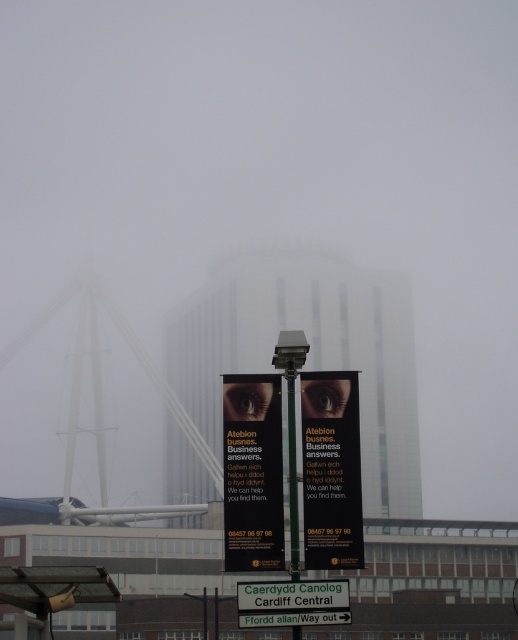
Can you confirm if black matte sign at center is positioned to the right of white plastic street sign at center?

Yes, black matte sign at center is to the right of white plastic street sign at center.

Can you confirm if black matte sign at center is positioned below white plastic street sign at center?

Actually, black matte sign at center is above white plastic street sign at center.

This screenshot has width=518, height=640. I want to click on black matte sign at center, so click(x=330, y=470).

Locate an element on the screen. black matte sign at center is located at coordinates (330, 470).

Is point (233, 564) farther from viewer compared to point (313, 488)?

No.

Does black matte banner at center appear on the right side of black matte sign at center?

No, black matte banner at center is not to the right of black matte sign at center.

Where is `black matte banner at center`? The image size is (518, 640). black matte banner at center is located at coordinates (252, 472).

Find the location of a particular element. The image size is (518, 640). black matte banner at center is located at coordinates (252, 472).

From the picture: Which of these two, black matte banner at center or white plastic street sign at center, stands shorter?

white plastic street sign at center is shorter.

Which of these two, black matte banner at center or white plastic street sign at center, stands taller?

black matte banner at center

Which is behind, point (266, 392) or point (263, 602)?

Point (266, 392)

Where is `black matte banner at center`? This screenshot has height=640, width=518. black matte banner at center is located at coordinates [252, 472].